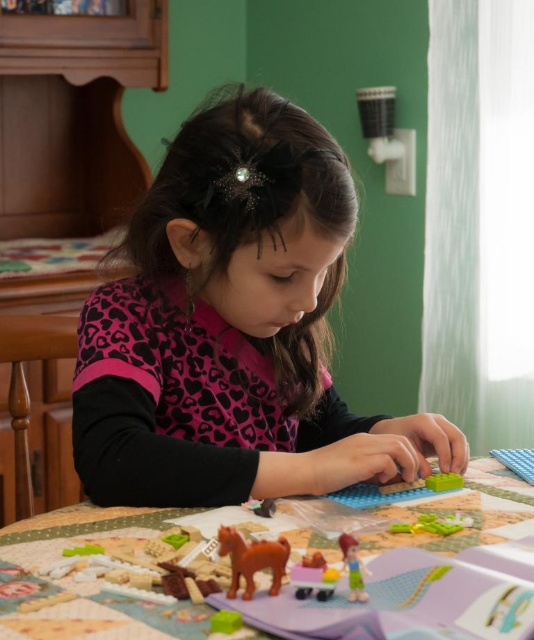
Question: Does wooden quilted table at center have a larger size compared to brown matte plastic horse at lower left?

Choices:
 (A) yes
 (B) no

Answer: (A)

Question: Does translucent plastic toy car at lower center have a greater width compared to translucent plastic toy figure at lower center?

Choices:
 (A) yes
 (B) no

Answer: (A)

Question: Which point is closer to the camera taking this photo?

Choices:
 (A) pos(341,550)
 (B) pos(491,483)
 (C) pos(442,516)

Answer: (A)

Question: Is pink leopard print shirt at center positioned at the back of translucent plastic toy car at lower center?

Choices:
 (A) no
 (B) yes

Answer: (B)

Question: Which object appears closest to the camera in this image?

Choices:
 (A) wooden quilted table at center
 (B) green plastic toy at lower center
 (C) translucent plastic toy figure at lower center
 (D) green matte block at lower center

Answer: (A)

Question: Which of these objects is positioned closest to the brown matte plastic horse at lower left?

Choices:
 (A) pink leopard print shirt at center
 (B) green matte block at lower center
 (C) green plastic toy at lower center

Answer: (C)